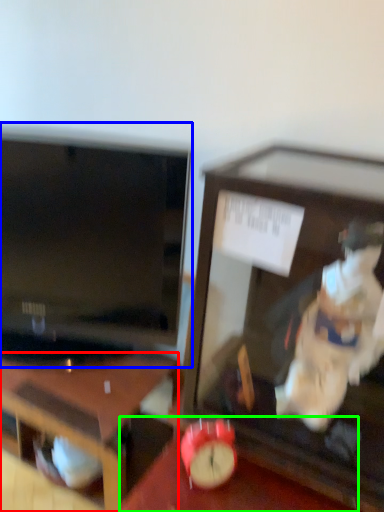
Question: Based on their relative distances, which object is nearer to desk (highlighted by a red box)? Choose from television (highlighted by a blue box) and table (highlighted by a green box).

Choices:
 (A) television
 (B) table

Answer: (B)